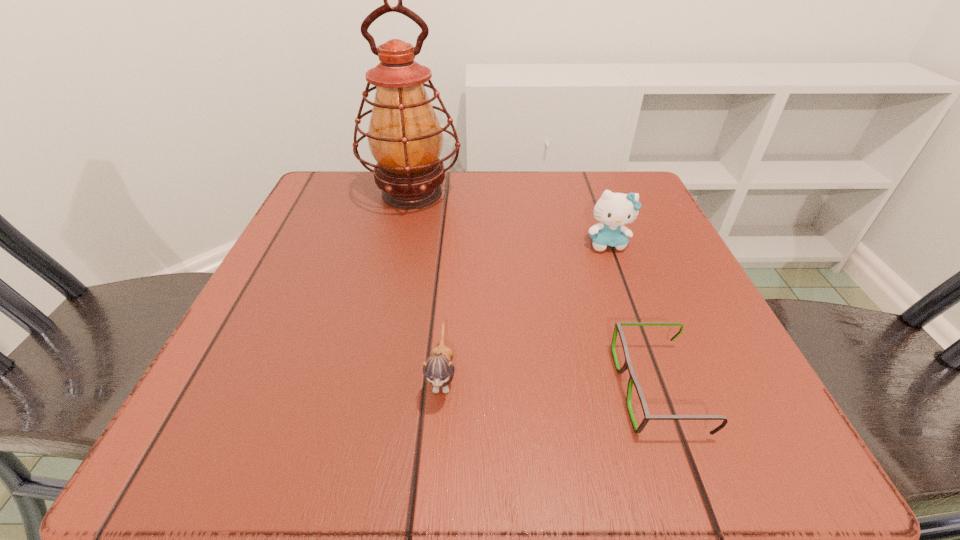
Identify the location of free spot between the second farthest object and the farthest object. The width and height of the screenshot is (960, 540). (510, 219).

This screenshot has height=540, width=960. I want to click on vacant area that lies between the third tallest object and the oil lamp, so click(427, 285).

Identify the location of vacant area between the shortest object and the third tallest object. The image size is (960, 540). (550, 382).

The height and width of the screenshot is (540, 960). Find the location of `vacant space that is in between the shortest object and the second tallest object`. vacant space that is in between the shortest object and the second tallest object is located at coordinates (633, 316).

Identify the location of vacant area that lies between the shortest object and the farthest object. Image resolution: width=960 pixels, height=540 pixels. point(535,291).

Find the location of a particular element. The image size is (960, 540). unoccupied area between the third shortest object and the shorter kitten is located at coordinates (525, 309).

Identify the location of free space between the shorter kitten and the right kitten. This screenshot has width=960, height=540. (525, 309).

You are a GUI agent. You are given a task and a screenshot of the screen. Output one action in this format:
    pyautogui.click(x=<x>, y=<y>)
    Task: Click on the vacant space that's between the third shortest object and the farthest object
    Image resolution: width=960 pixels, height=540 pixels.
    Given the screenshot: What is the action you would take?
    pyautogui.click(x=510, y=219)

The image size is (960, 540). In order to click on free area in between the oil lamp and the right kitten in this screenshot , I will do `click(510, 219)`.

The height and width of the screenshot is (540, 960). What are the coordinates of `object that is the closest one to the oil lamp` in the screenshot? It's located at (614, 210).